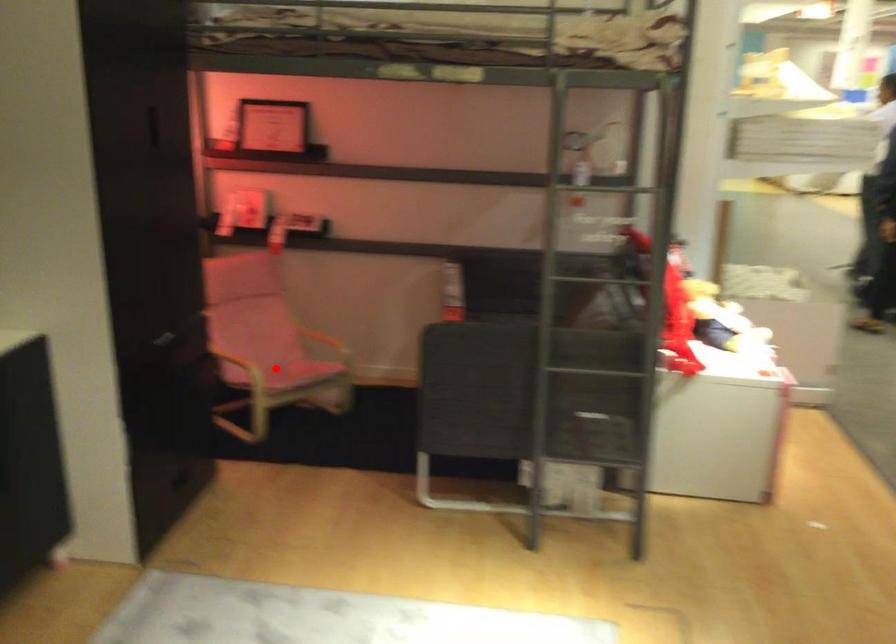
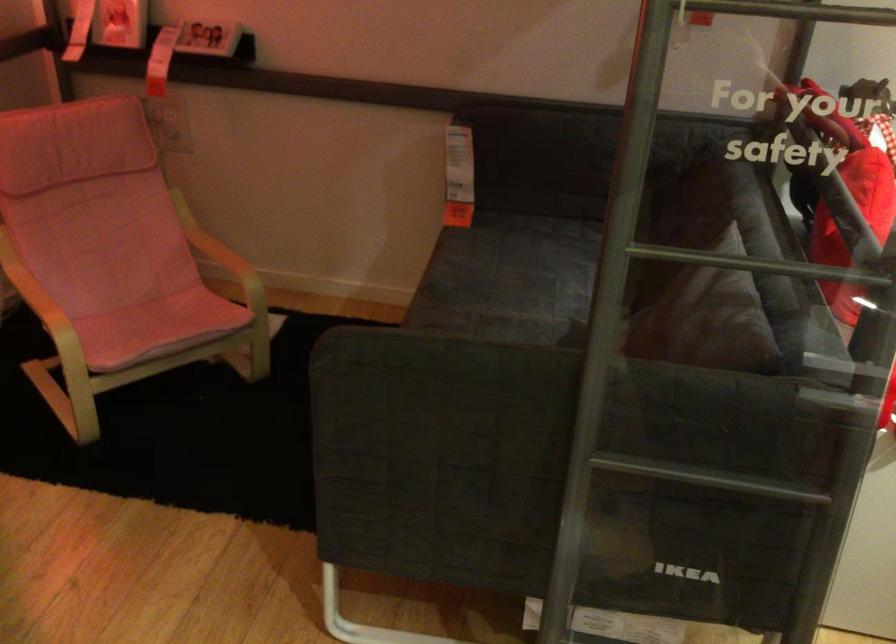
In the second image, find the point that corresponds to the highlighted location in the first image.

(126, 307)